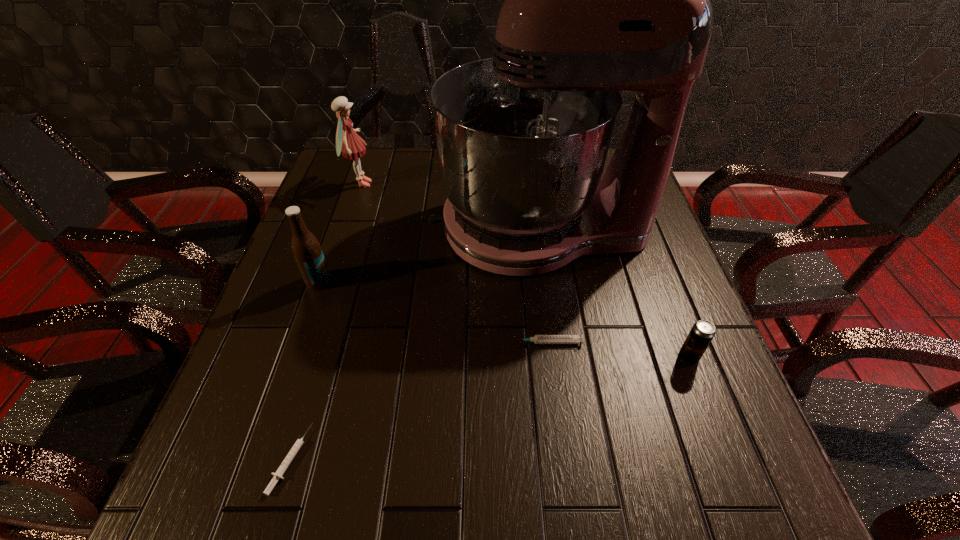
Find the location of a particular element. This screenshot has width=960, height=540. mixer is located at coordinates (598, 0).

Locate an element on the screen. This screenshot has height=540, width=960. the fifth shortest object is located at coordinates (348, 142).

Image resolution: width=960 pixels, height=540 pixels. Identify the location of beer bottle. (306, 249).

Locate an element on the screen. beer can is located at coordinates (701, 334).

Where is `the second shortest object`? the second shortest object is located at coordinates (537, 339).

Find the location of a particular element. the right syringe is located at coordinates (537, 339).

I want to click on the nearest object, so click(278, 474).

Where is `the left syringe`? Image resolution: width=960 pixels, height=540 pixels. the left syringe is located at coordinates (278, 474).

Find the location of a particular element. The width and height of the screenshot is (960, 540). vacant space located 0.330m on the front-facing side of the mixer is located at coordinates (303, 228).

Locate an element on the screen. This screenshot has height=540, width=960. free space located on the front-facing side of the mixer is located at coordinates (406, 228).